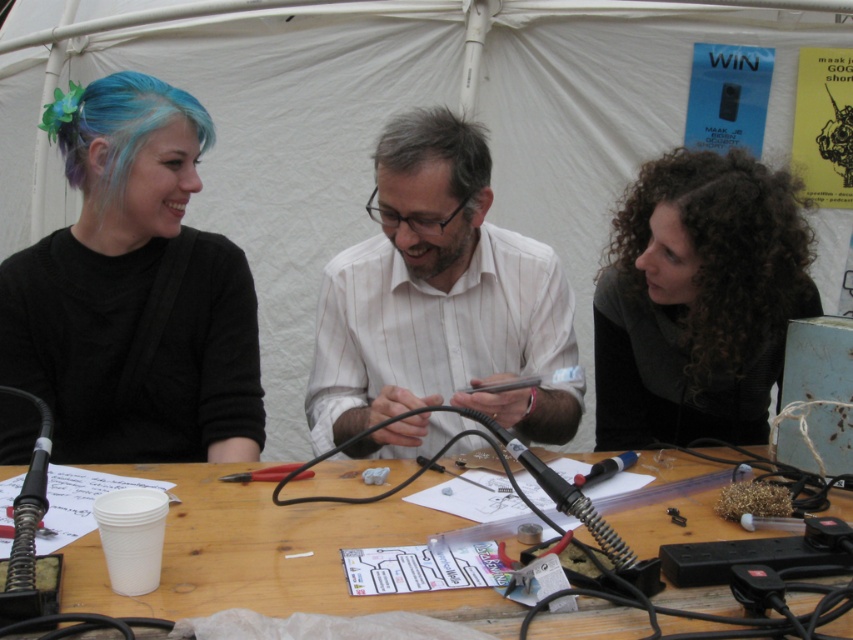
You are a photographer positioned at the entrance of the tent. You want to take a photo of the curly hair at upper right and the black matte hair at left so that both are clearly visible. Considering their positions, which person should be closer to the camera to ensure both are in focus?

The black matte hair at left should be closer to the camera because the curly hair at upper right is behind it, so positioning the black matte hair at left forward will keep both in focus without one being obscured.

What is located at the coordinates point (135, 294) in the image?

The black matte hair at left is located at point (135, 294).

You are a photographer planning to take a group photo of the people under the white fabric tent at upper center and the person wearing the white striped shirt at center. Considering the size difference between the two, which object would you focus on to ensure both are clearly visible in the frame?

The white fabric tent at upper center is larger than the white striped shirt at center, so focusing on the white fabric tent at upper center would ensure both are visible as it occupies more space in the scene.